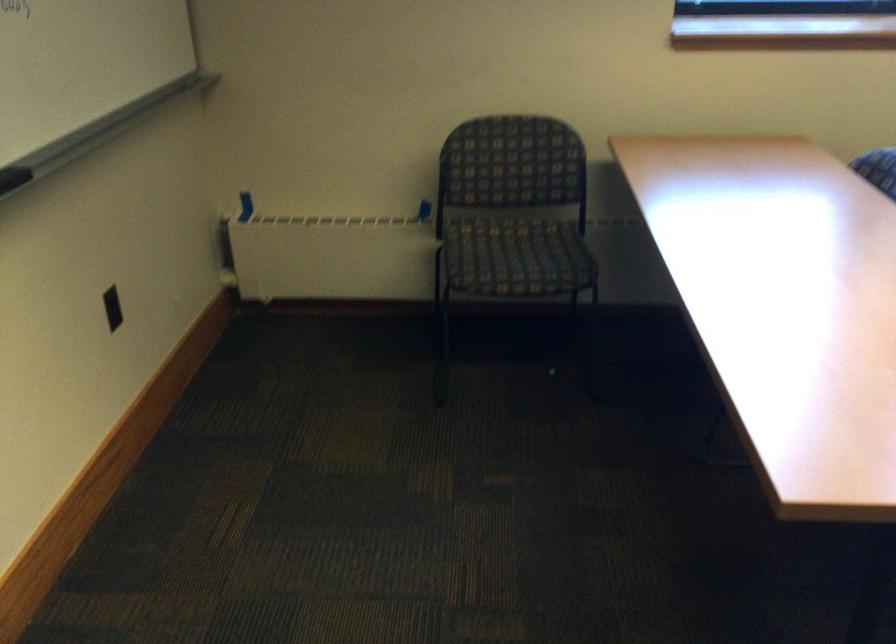
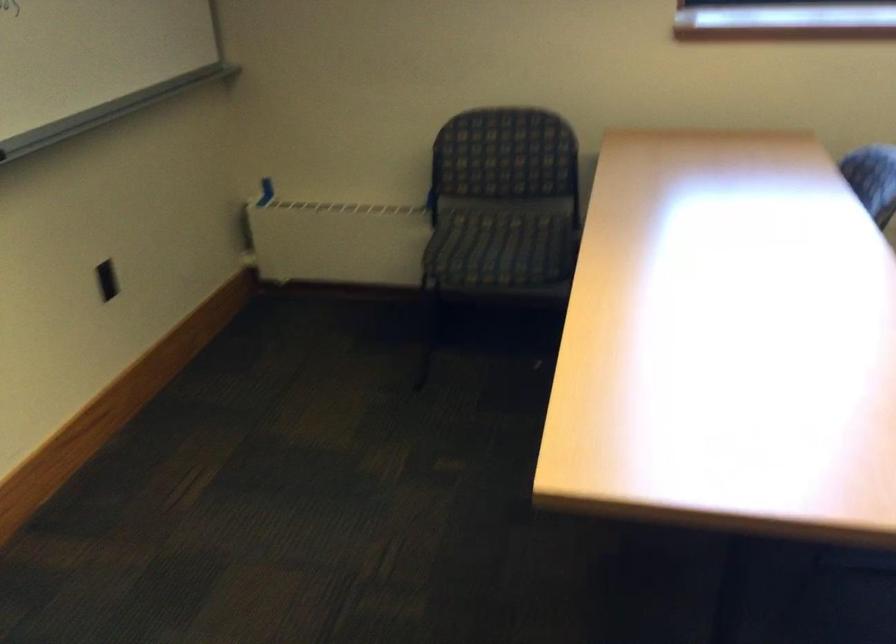
Question: The images are taken continuously from a first-person perspective. In which direction are you moving?

Choices:
 (A) Left
 (B) Right
 (C) Forward
 (D) Backward

Answer: (B)